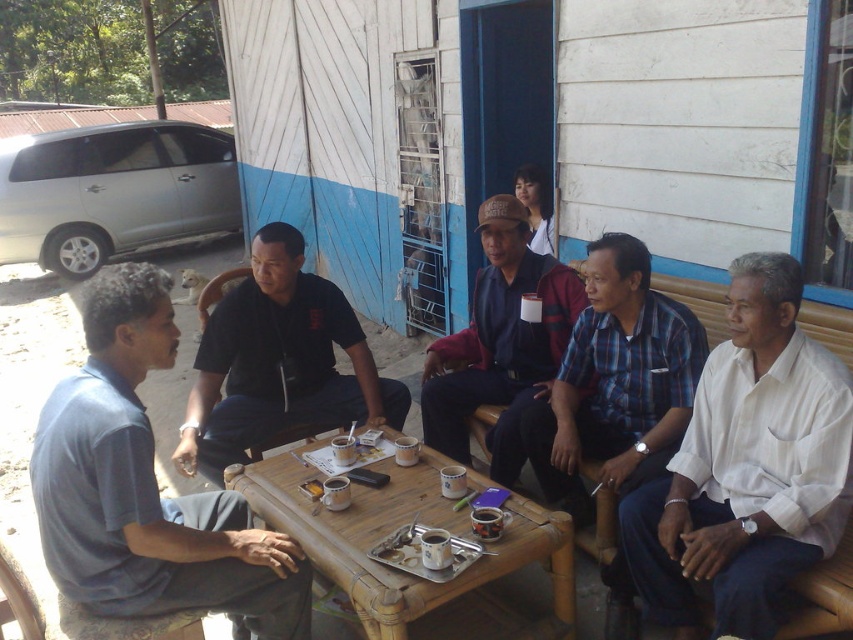
Question: Is blue cotton shirt at left closer to the viewer compared to dark blue fabric jacket at center?

Choices:
 (A) no
 (B) yes

Answer: (B)

Question: Which point is farther to the camera?

Choices:
 (A) (352, 360)
 (B) (444, 625)
 (C) (67, 484)

Answer: (A)

Question: Among these objects, which one is farthest from the camera?

Choices:
 (A) bamboo table at center
 (B) blue cotton shirt at left

Answer: (A)

Question: Which of the following is the farthest from the observer?

Choices:
 (A) (543, 632)
 (B) (70, 544)

Answer: (A)

Question: Observing the image, what is the correct spatial positioning of bamboo table at center in reference to black matte shirt at center?

Choices:
 (A) left
 (B) right

Answer: (B)

Question: Does blue cotton shirt at left come behind black matte shirt at center?

Choices:
 (A) no
 (B) yes

Answer: (A)